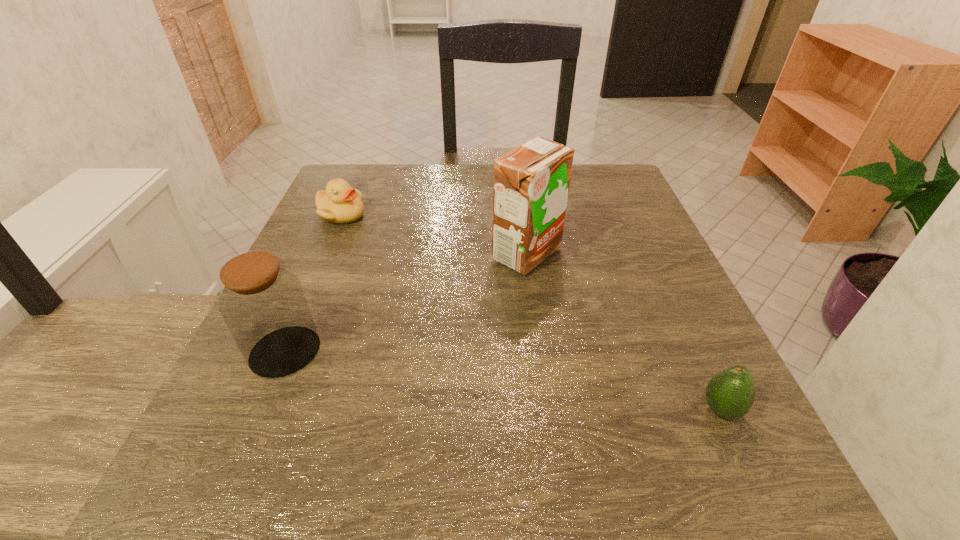
You are a GUI agent. You are given a task and a screenshot of the screen. Output one action in this format:
    pyautogui.click(x=<x>, y=<y>)
    Task: Click on the free region located on the right of the third farthest object
    The height and width of the screenshot is (540, 960).
    Given the screenshot: What is the action you would take?
    pyautogui.click(x=357, y=352)

Find the location of a particular element. Image resolution: width=960 pixels, height=540 pixels. free region located on the beak of the duckling is located at coordinates click(452, 215).

Locate an element on the screen. Image resolution: width=960 pixels, height=540 pixels. vacant area located 0.260m on the back of the rightmost object is located at coordinates (660, 278).

The image size is (960, 540). Find the location of `object located at the far edge`. object located at the far edge is located at coordinates (340, 203).

Image resolution: width=960 pixels, height=540 pixels. I want to click on jar at the left edge, so click(x=263, y=304).

Find the location of `duckling that is at the left edge`. duckling that is at the left edge is located at coordinates (340, 203).

Identify the location of object that is positioned at the right edge. (730, 393).

Image resolution: width=960 pixels, height=540 pixels. In order to click on object present at the far left corner in this screenshot , I will do `click(340, 203)`.

Where is `vacant area at the far edge`? vacant area at the far edge is located at coordinates (412, 187).

In order to click on vacant space at the near edge of the desktop in this screenshot , I will do `click(567, 477)`.